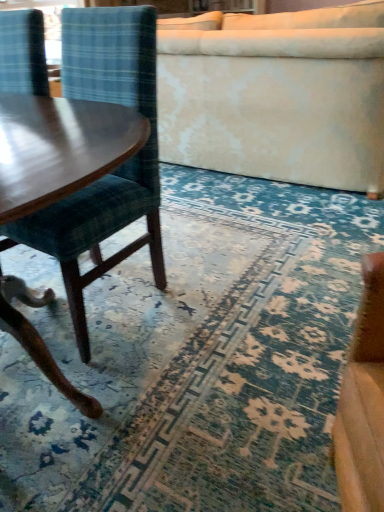
Question: Is velvet cream studio couch at upper center at the right side of velvet plaid chair at left?

Choices:
 (A) no
 (B) yes

Answer: (B)

Question: From a real-world perspective, is velvet cream studio couch at upper center on velvet plaid chair at left?

Choices:
 (A) no
 (B) yes

Answer: (A)

Question: Can velvet plaid chair at left be found inside velvet cream studio couch at upper center?

Choices:
 (A) yes
 (B) no

Answer: (B)

Question: Can you confirm if velvet cream studio couch at upper center is bigger than velvet plaid chair at left?

Choices:
 (A) yes
 (B) no

Answer: (A)

Question: From the image's perspective, does velvet cream studio couch at upper center appear lower than velvet plaid chair at left?

Choices:
 (A) no
 (B) yes

Answer: (A)

Question: Can you confirm if velvet cream studio couch at upper center is smaller than velvet plaid chair at left?

Choices:
 (A) yes
 (B) no

Answer: (B)

Question: Is blue textured rug at center bigger than velvet plaid chair at left?

Choices:
 (A) yes
 (B) no

Answer: (B)

Question: Considering the relative positions of blue textured rug at center and velvet plaid chair at left in the image provided, is blue textured rug at center to the left of velvet plaid chair at left from the viewer's perspective?

Choices:
 (A) yes
 (B) no

Answer: (B)

Question: From a real-world perspective, is blue textured rug at center located higher than velvet plaid chair at left?

Choices:
 (A) no
 (B) yes

Answer: (A)

Question: Does blue textured rug at center have a lesser width compared to velvet plaid chair at left?

Choices:
 (A) no
 (B) yes

Answer: (A)

Question: Could you tell me if blue textured rug at center is facing velvet plaid chair at left?

Choices:
 (A) no
 (B) yes

Answer: (A)

Question: Is the position of blue textured rug at center more distant than that of velvet plaid chair at left?

Choices:
 (A) no
 (B) yes

Answer: (A)

Question: Is velvet plaid chair at left taller than blue textured rug at center?

Choices:
 (A) yes
 (B) no

Answer: (A)